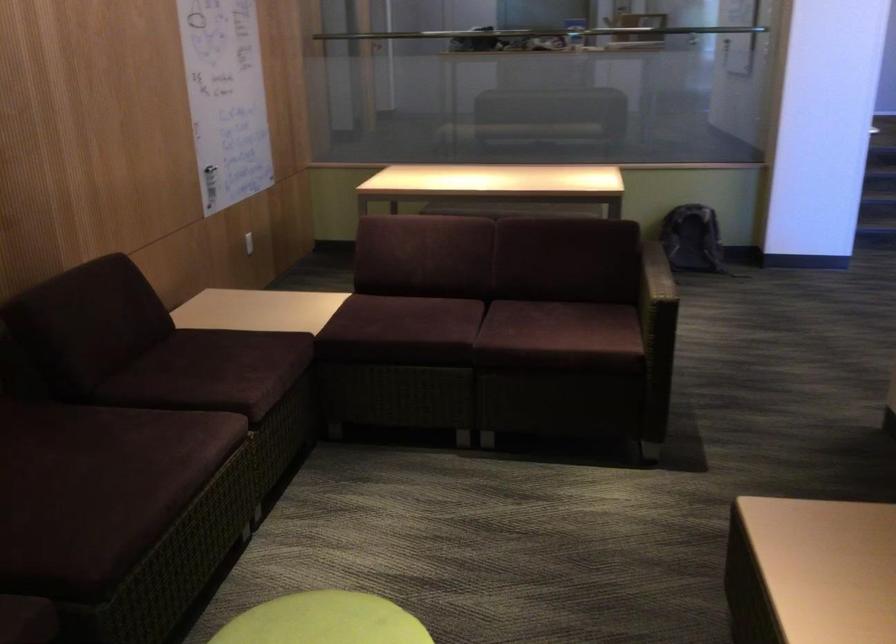
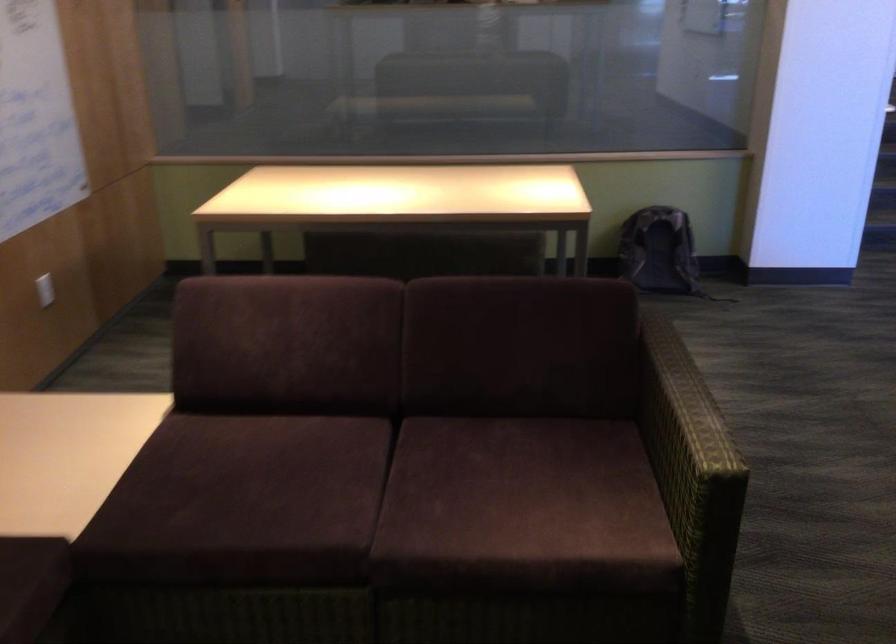
In the second image, find the point that corresponds to (658,272) in the first image.

(682, 404)